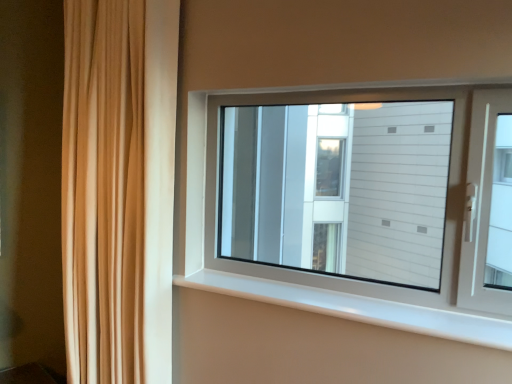
Question: Considering the positions of beige fabric curtain at left and white plastic window sill at center in the image, is beige fabric curtain at left taller or shorter than white plastic window sill at center?

Choices:
 (A) tall
 (B) short

Answer: (A)

Question: Considering the relative positions of beige fabric curtain at left and white plastic window sill at center in the image provided, is beige fabric curtain at left to the left or to the right of white plastic window sill at center?

Choices:
 (A) left
 (B) right

Answer: (A)

Question: Is beige fabric curtain at left inside or outside of white plastic window sill at center?

Choices:
 (A) outside
 (B) inside

Answer: (A)

Question: Relative to beige fabric curtain at left, is white plastic window sill at center in front or behind?

Choices:
 (A) front
 (B) behind

Answer: (A)

Question: In terms of width, does white plastic window sill at center look wider or thinner when compared to beige fabric curtain at left?

Choices:
 (A) wide
 (B) thin

Answer: (B)

Question: Considering the positions of white plastic window sill at center and beige fabric curtain at left in the image, is white plastic window sill at center taller or shorter than beige fabric curtain at left?

Choices:
 (A) tall
 (B) short

Answer: (B)

Question: Looking at the image, does white plastic window sill at center seem bigger or smaller compared to beige fabric curtain at left?

Choices:
 (A) small
 (B) big

Answer: (A)